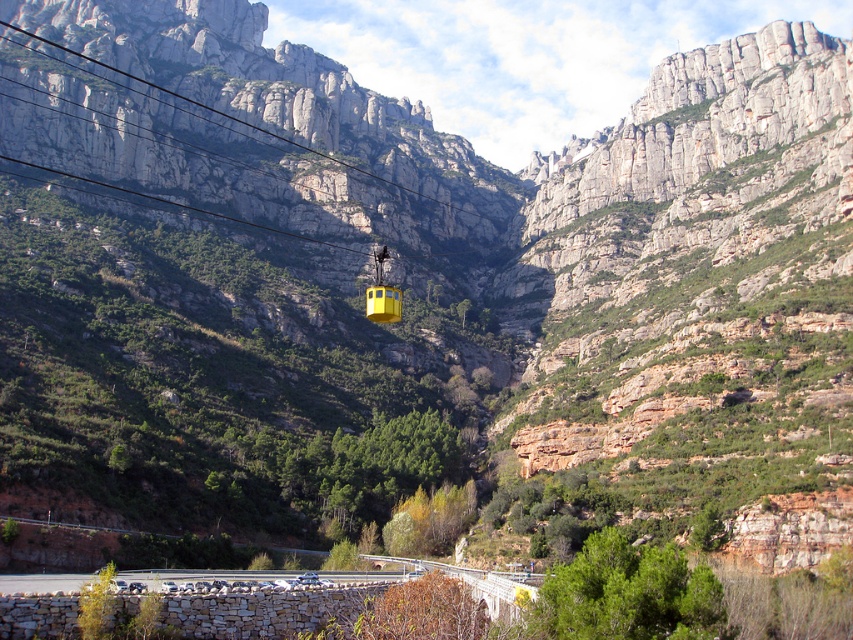
How far apart are smooth wire at upper center and yellow matte cable car at center?

smooth wire at upper center and yellow matte cable car at center are 83.18 meters apart.

Is smooth wire at upper center taller than yellow matte cable car at center?

Yes.

Which is behind, point (302, 145) or point (393, 316)?

The point (302, 145) is behind.

The image size is (853, 640). In order to click on smooth wire at upper center in this screenshot , I will do `click(233, 116)`.